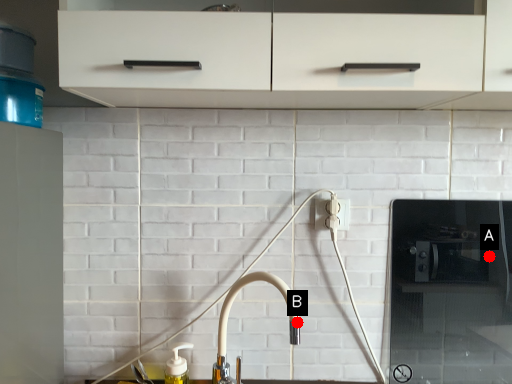
Question: Two points are circled on the image, labeled by A and B beside each circle. Which of the following is the farthest from the observer?

Choices:
 (A) A is further
 (B) B is further

Answer: (A)